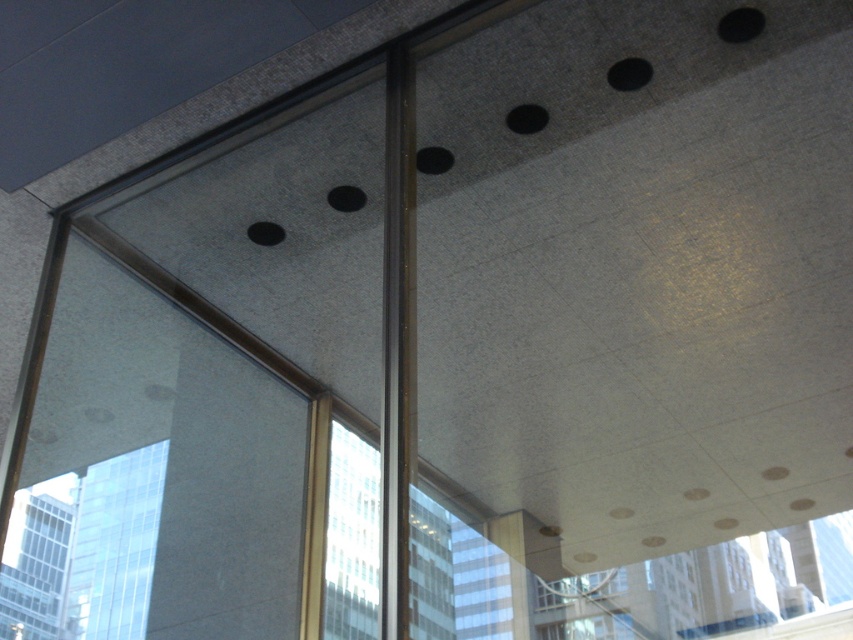
You are an interior designer planning to place two identical floor lamps in the space. You want to position each lamp next to the transparent glass window at lower right and the transparent glass window at lower left. Considering their widths, which window requires a wider base for the lamp stand?

The transparent glass window at lower right might require a wider base for the lamp stand since it might be wider than the transparent glass window at lower left, necessitating a larger base to maintain stability.

You are standing in the room and want to look out the transparent glass window at lower right. Based on its 2D coordinates, where should you direct your gaze to locate it?

The transparent glass window at lower right is located at the 2D coordinates point (705, 588), so you should direct your gaze towards the lower right area of the space to locate it.